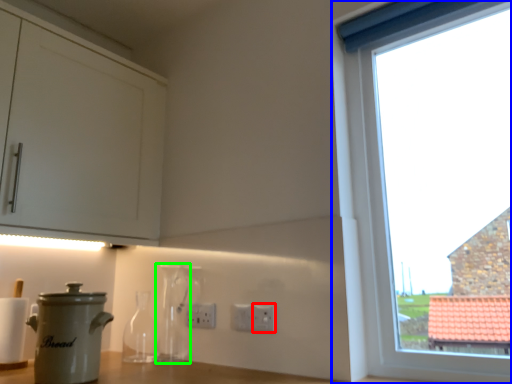
Question: Estimate the real-world distances between objects in this image. Which object is farther from electric outlet (highlighted by a red box), window (highlighted by a blue box) or bottle (highlighted by a green box)?

Choices:
 (A) window
 (B) bottle

Answer: (A)